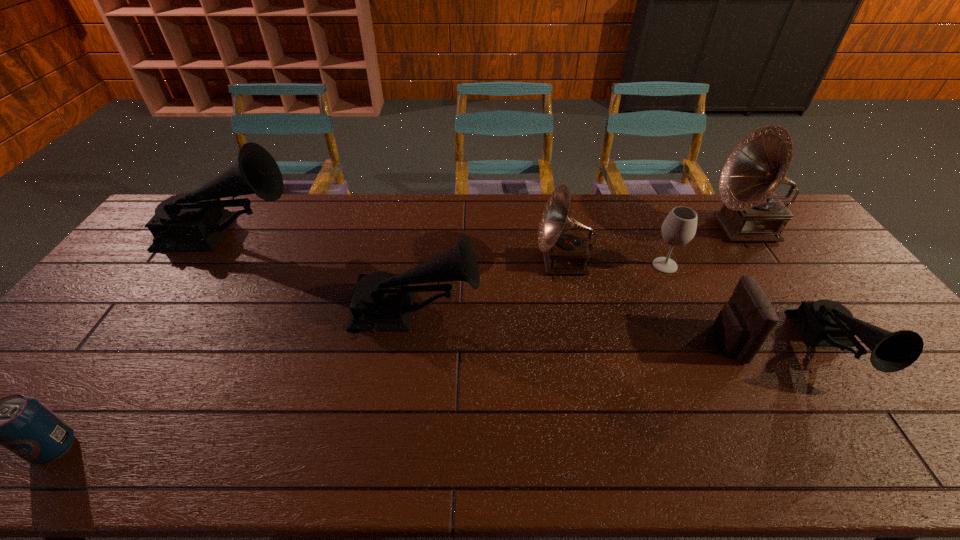
At what (x,y) coordinates should I click in order to perform the action: click on vacant point located from the horn of the second smallest black phonograph_record. Please return your answer as a coordinate pair (x, y). Looking at the image, I should click on (562, 312).

Where is `free space located 0.320m on the left of the wineglass`? The image size is (960, 540). free space located 0.320m on the left of the wineglass is located at coordinates (547, 265).

This screenshot has height=540, width=960. Identify the location of vacant space located from the horn of the rightmost black phonograph_record. (914, 467).

Find the location of a particular element. free location located 0.400m with an open flap on the pouch is located at coordinates click(564, 342).

Identify the location of vacant space located with an open flap on the pouch. This screenshot has width=960, height=540. (610, 342).

The image size is (960, 540). What are the coordinates of `free space located 0.260m with an open flap on the pouch` in the screenshot? It's located at (617, 342).

In order to click on free location located on the left of the shortest object in this screenshot , I will do `click(2, 447)`.

This screenshot has height=540, width=960. I want to click on object that is at the near edge, so click(23, 425).

Where is `phonograph_record situated at the left edge`? Image resolution: width=960 pixels, height=540 pixels. phonograph_record situated at the left edge is located at coordinates (195, 221).

Where is `pop soda present at the left edge`? This screenshot has height=540, width=960. pop soda present at the left edge is located at coordinates (23, 425).